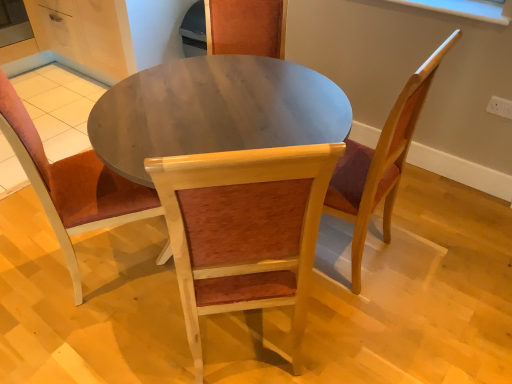
Identify the location of wooden chair at center, marked as the first chair in a left-to-right arrangement. (72, 184).

Locate an element on the screen. wooden chair at center, the third chair in the right-to-left sequence is located at coordinates (72, 184).

Looking at this image, considering the sizes of wooden chair at center, the 2th chair in the right-to-left sequence, and wooden chair with cushion at center, which is counted as the first chair, starting from the right, in the image, is wooden chair at center, the 2th chair in the right-to-left sequence, bigger or smaller than wooden chair with cushion at center, which is counted as the first chair, starting from the right,?

In the image, wooden chair at center, the 2th chair in the right-to-left sequence, appears to be larger than wooden chair with cushion at center, which is counted as the first chair, starting from the right.

From the image's perspective, which is below, wooden chair at center, which appears as the 2th chair when viewed from the left, or wooden chair with cushion at center, which is counted as the first chair, starting from the right?

From the image's view, wooden chair at center, which appears as the 2th chair when viewed from the left, is below.

Considering the positions of objects wooden chair at center, which appears as the 2th chair when viewed from the left, and wooden chair with cushion at center, which is counted as the first chair, starting from the right, in the image provided, who is in front, wooden chair at center, which appears as the 2th chair when viewed from the left, or wooden chair with cushion at center, which is counted as the first chair, starting from the right,?

wooden chair at center, which appears as the 2th chair when viewed from the left, is closer to the camera.

Find the location of a particular element. The width and height of the screenshot is (512, 384). chair that is the 2nd one when counting rightward from the wooden chair at center, marked as the first chair in a left-to-right arrangement is located at coordinates (380, 163).

Is the position of wooden chair with cushion at center, acting as the third chair starting from the left, more distant than that of wooden chair at center, the third chair in the right-to-left sequence?

Yes, it is.

From the image's perspective, does wooden chair with cushion at center, which is counted as the first chair, starting from the right, appear higher than wooden chair at center, marked as the first chair in a left-to-right arrangement?

Yes.

Is wooden chair with cushion at center, which is counted as the first chair, starting from the right, next to wooden chair at center, the third chair in the right-to-left sequence?

wooden chair with cushion at center, which is counted as the first chair, starting from the right, is not next to wooden chair at center, the third chair in the right-to-left sequence, and they're not touching.

The height and width of the screenshot is (384, 512). Find the location of `the 1st chair above when counting from the wooden chair at center, which appears as the 2th chair when viewed from the left (from the image's perspective)`. the 1st chair above when counting from the wooden chair at center, which appears as the 2th chair when viewed from the left (from the image's perspective) is located at coordinates (72, 184).

Is wooden chair at center, the 2th chair in the right-to-left sequence, next to wooden chair at center, marked as the first chair in a left-to-right arrangement, and touching it?

They are not placed beside each other.

Could you tell me if wooden chair at center, the 2th chair in the right-to-left sequence, is facing wooden chair at center, the third chair in the right-to-left sequence?

No, wooden chair at center, the 2th chair in the right-to-left sequence, is not aimed at wooden chair at center, the third chair in the right-to-left sequence.

Looking at this image, how different are the orientations of wooden chair at center, the 2th chair in the right-to-left sequence, and wooden chair at center, marked as the first chair in a left-to-right arrangement, in degrees?

72.6 degrees.

Is the position of wooden chair with cushion at center, which is counted as the first chair, starting from the right, more distant than that of wooden chair at center, the 2th chair in the right-to-left sequence?

Yes, wooden chair with cushion at center, which is counted as the first chair, starting from the right, is further from the camera.

Is wooden chair with cushion at center, acting as the third chair starting from the left, inside the boundaries of wooden chair at center, which appears as the 2th chair when viewed from the left, or outside?

wooden chair with cushion at center, acting as the third chair starting from the left, lies outside wooden chair at center, which appears as the 2th chair when viewed from the left.

Would you say wooden chair at center, the third chair in the right-to-left sequence, is a long distance from wooden chair with cushion at center, acting as the third chair starting from the left?

wooden chair at center, the third chair in the right-to-left sequence, is near wooden chair with cushion at center, acting as the third chair starting from the left, not far away.

Locate an element on the screen. This screenshot has height=384, width=512. chair behind the wooden chair at center, marked as the first chair in a left-to-right arrangement is located at coordinates (380, 163).

Is wooden chair at center, marked as the first chair in a left-to-right arrangement, surrounding wooden chair with cushion at center, acting as the third chair starting from the left?

No, wooden chair with cushion at center, acting as the third chair starting from the left, is not inside wooden chair at center, marked as the first chair in a left-to-right arrangement.

Would you say wooden chair at center, the 2th chair in the right-to-left sequence, is part of wooden chair at center, the third chair in the right-to-left sequence,'s contents?

No, wooden chair at center, the 2th chair in the right-to-left sequence, is not surrounded by wooden chair at center, the third chair in the right-to-left sequence.

Is wooden chair at center, marked as the first chair in a left-to-right arrangement, positioned before wooden chair at center, the 2th chair in the right-to-left sequence?

That is False.

In terms of width, does wooden chair at center, the third chair in the right-to-left sequence, look wider or thinner when compared to wooden chair at center, which appears as the 2th chair when viewed from the left?

Clearly, wooden chair at center, the third chair in the right-to-left sequence, has more width compared to wooden chair at center, which appears as the 2th chair when viewed from the left.

In terms of size, does wooden chair at center, the third chair in the right-to-left sequence, appear bigger or smaller than wooden chair at center, the 2th chair in the right-to-left sequence?

Considering their sizes, wooden chair at center, the third chair in the right-to-left sequence, takes up less space than wooden chair at center, the 2th chair in the right-to-left sequence.

Starting from the wooden chair with cushion at center, acting as the third chair starting from the left, which chair is the 1st one to the left? Please provide its 2D coordinates.

[(244, 229)]

I want to click on the 1st chair in front of the wooden chair with cushion at center, acting as the third chair starting from the left, counting from the anchor's position, so click(x=72, y=184).

When comparing their distances from wooden chair with cushion at center, which is counted as the first chair, starting from the right, does wooden chair at center, which appears as the 2th chair when viewed from the left, or wooden chair at center, marked as the first chair in a left-to-right arrangement, seem closer?

The object closer to wooden chair with cushion at center, which is counted as the first chair, starting from the right, is wooden chair at center, which appears as the 2th chair when viewed from the left.

When comparing their distances from wooden chair at center, marked as the first chair in a left-to-right arrangement, does wooden chair at center, the 2th chair in the right-to-left sequence, or wooden chair with cushion at center, acting as the third chair starting from the left, seem closer?

wooden chair at center, the 2th chair in the right-to-left sequence, lies closer to wooden chair at center, marked as the first chair in a left-to-right arrangement, than the other object.

Estimate the real-world distances between objects in this image. Which object is closer to wooden chair at center, the 2th chair in the right-to-left sequence, wooden chair with cushion at center, acting as the third chair starting from the left, or wooden chair at center, marked as the first chair in a left-to-right arrangement?

wooden chair with cushion at center, acting as the third chair starting from the left, lies closer to wooden chair at center, the 2th chair in the right-to-left sequence, than the other object.

When comparing their distances from wooden chair at center, the third chair in the right-to-left sequence, does wooden chair with cushion at center, which is counted as the first chair, starting from the right, or wooden chair at center, which appears as the 2th chair when viewed from the left, seem further?

The object further to wooden chair at center, the third chair in the right-to-left sequence, is wooden chair with cushion at center, which is counted as the first chair, starting from the right.

Estimate the real-world distances between objects in this image. Which object is further from wooden chair with cushion at center, which is counted as the first chair, starting from the right, wooden chair at center, marked as the first chair in a left-to-right arrangement, or wooden chair at center, the 2th chair in the right-to-left sequence?

wooden chair at center, marked as the first chair in a left-to-right arrangement.

Which object lies nearer to the anchor point wooden chair at center, the 2th chair in the right-to-left sequence, wooden chair at center, marked as the first chair in a left-to-right arrangement, or wooden chair with cushion at center, which is counted as the first chair, starting from the right?

The object closer to wooden chair at center, the 2th chair in the right-to-left sequence, is wooden chair with cushion at center, which is counted as the first chair, starting from the right.

Find the location of `chair between wooden chair at center, the third chair in the right-to-left sequence, and wooden chair with cushion at center, acting as the third chair starting from the left`. chair between wooden chair at center, the third chair in the right-to-left sequence, and wooden chair with cushion at center, acting as the third chair starting from the left is located at coordinates (244, 229).